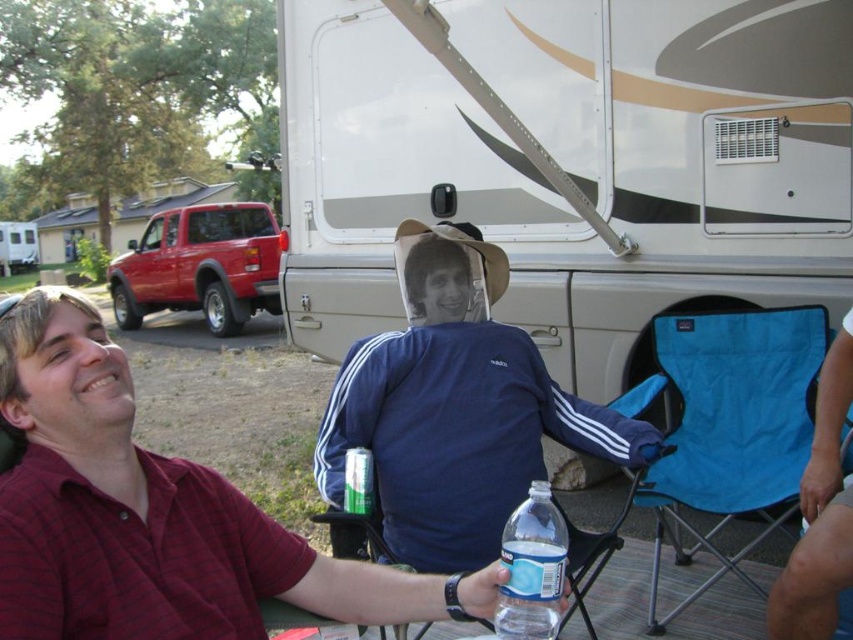
Between blue fabric chair at lower right and white glossy recreational vehicle at upper center, which one is positioned higher?

white glossy recreational vehicle at upper center is higher up.

Does blue fabric chair at lower right come behind white glossy recreational vehicle at upper center?

That is False.

The height and width of the screenshot is (640, 853). In order to click on blue fabric chair at lower right in this screenshot , I will do `click(728, 424)`.

Is maroon cotton shirt at lower left shorter than clear plastic bottle at lower center?

In fact, maroon cotton shirt at lower left may be taller than clear plastic bottle at lower center.

Which is behind, point (251, 582) or point (538, 572)?

Positioned behind is point (251, 582).

Image resolution: width=853 pixels, height=640 pixels. I want to click on maroon cotton shirt at lower left, so click(154, 515).

Between point (119, 316) and point (544, 492), which one is positioned in front?

Point (544, 492) is more forward.

Can you confirm if metallic red truck at left is bigger than clear plastic bottle at lower center?

Actually, metallic red truck at left might be smaller than clear plastic bottle at lower center.

What do you see at coordinates (200, 266) in the screenshot? I see `metallic red truck at left` at bounding box center [200, 266].

You are a GUI agent. You are given a task and a screenshot of the screen. Output one action in this format:
    pyautogui.click(x=<x>, y=<y>)
    Task: Click on the metallic red truck at left
    The height and width of the screenshot is (640, 853).
    Given the screenshot: What is the action you would take?
    pyautogui.click(x=200, y=266)